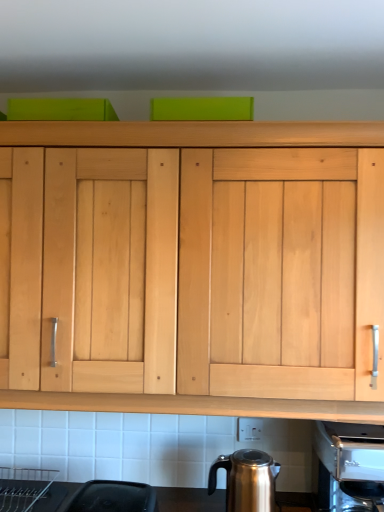
Question: From the image's perspective, is satin silver coffee machine at lower right located above or below shiny metallic kettle at lower center?

Choices:
 (A) below
 (B) above

Answer: (B)

Question: Looking at their shapes, would you say satin silver coffee machine at lower right is wider or thinner than shiny metallic kettle at lower center?

Choices:
 (A) thin
 (B) wide

Answer: (B)

Question: In terms of size, does satin silver coffee machine at lower right appear bigger or smaller than shiny metallic kettle at lower center?

Choices:
 (A) small
 (B) big

Answer: (B)

Question: From the image's perspective, is shiny metallic kettle at lower center positioned above or below satin silver coffee machine at lower right?

Choices:
 (A) below
 (B) above

Answer: (A)

Question: Looking at their shapes, would you say shiny metallic kettle at lower center is wider or thinner than satin silver coffee machine at lower right?

Choices:
 (A) wide
 (B) thin

Answer: (B)

Question: Visually, is shiny metallic kettle at lower center positioned to the left or to the right of satin silver coffee machine at lower right?

Choices:
 (A) right
 (B) left

Answer: (B)

Question: Is shiny metallic kettle at lower center inside or outside of satin silver coffee machine at lower right?

Choices:
 (A) inside
 (B) outside

Answer: (B)